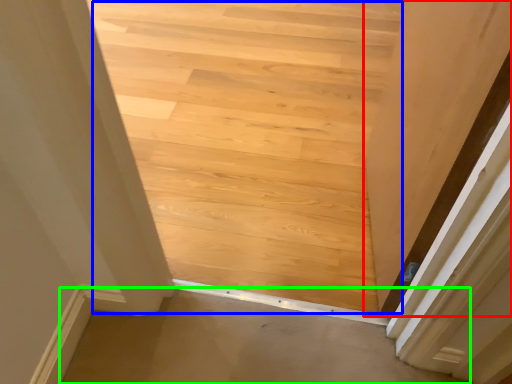
Question: Which object is positioned closest to door (highlighted by a red box)? Select from stairwell (highlighted by a blue box) and plain (highlighted by a green box).

Choices:
 (A) stairwell
 (B) plain

Answer: (B)